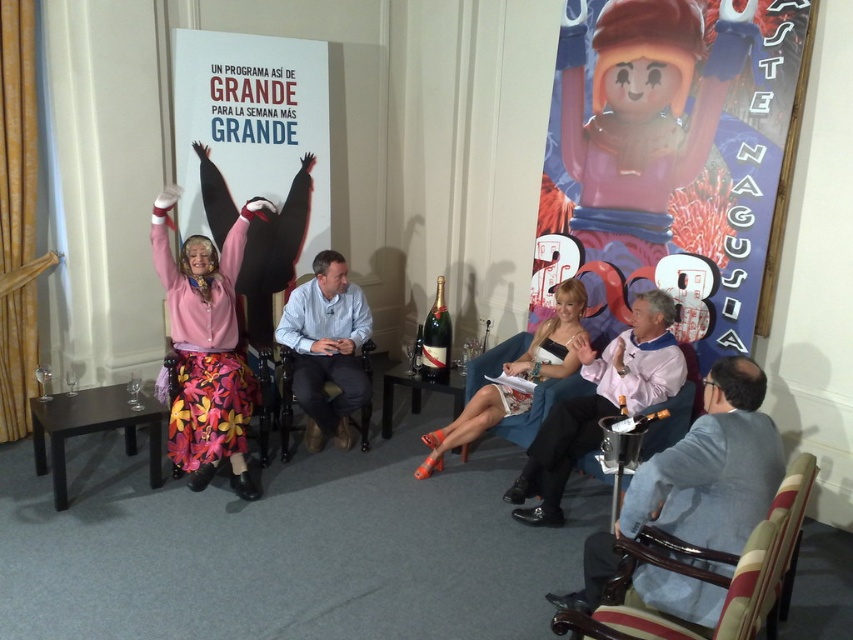
Is matte pink fabric at upper left smaller than light blue shirt at center?

No, matte pink fabric at upper left is not smaller than light blue shirt at center.

Image resolution: width=853 pixels, height=640 pixels. Find the location of `matte pink fabric at upper left`. matte pink fabric at upper left is located at coordinates click(254, 152).

Does light blue shirt at center have a lesser width compared to floral fabric armchair at center?

Yes, light blue shirt at center is thinner than floral fabric armchair at center.

Is light blue shirt at center bigger than floral fabric armchair at center?

Actually, light blue shirt at center might be smaller than floral fabric armchair at center.

Which is behind, point (299, 392) or point (260, 444)?

The point (260, 444) is more distant.

Locate an element on the screen. Image resolution: width=853 pixels, height=640 pixels. light blue shirt at center is located at coordinates (326, 348).

Can you confirm if floral fabric armchair at center is taller than green glass bottle at center?

Indeed, floral fabric armchair at center has a greater height compared to green glass bottle at center.

Is floral fabric armchair at center shorter than green glass bottle at center?

No, floral fabric armchair at center is not shorter than green glass bottle at center.

Does point (221, 426) come behind point (434, 326)?

That is False.

I want to click on floral fabric armchair at center, so click(212, 401).